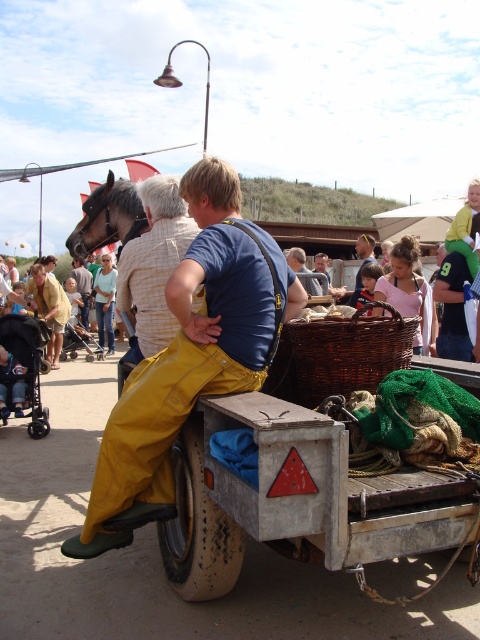
Question: Where is yellow canvas overalls at center located in relation to yellow cotton pants at center in the image?

Choices:
 (A) below
 (B) above

Answer: (A)

Question: Which of the following is the closest to the observer?

Choices:
 (A) dark brown glossy horse at left
 (B) yellow cotton pants at center

Answer: (A)

Question: Based on their relative distances, which object is nearer to the yellow cotton pants at center?

Choices:
 (A) blue denim shirt at center
 (B) smooth beige shirt at center

Answer: (B)

Question: Does yellow canvas overalls at center have a larger size compared to blue denim shirt at center?

Choices:
 (A) no
 (B) yes

Answer: (B)

Question: Among these objects, which one is farthest from the camera?

Choices:
 (A) dark brown glossy horse at left
 (B) smooth beige shirt at center
 (C) blue denim shirt at center
 (D) yellow canvas overalls at center

Answer: (C)

Question: Does yellow cotton pants at center appear on the left side of smooth beige shirt at center?

Choices:
 (A) no
 (B) yes

Answer: (B)